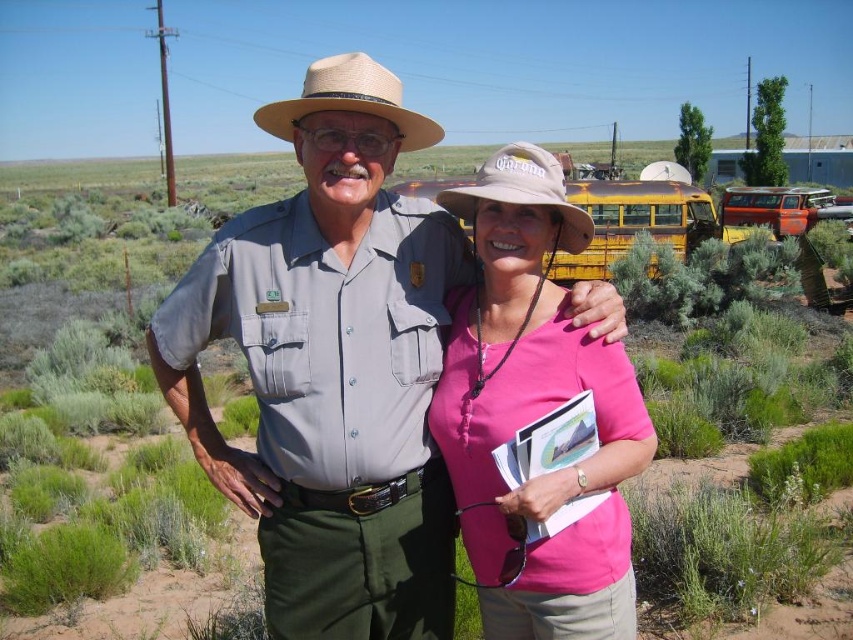
Based on the photo, you are a park visitor who wants to place a 3.5 feet wide picnic basket between the tan straw cowboy hat at center and the tan fabric cowboy hat at center. Can you fit it there?

The distance between the tan straw cowboy hat at center and the tan fabric cowboy hat at center is 4.76 feet. Since the picnic basket is 3.5 feet wide, it can fit within the space as 3.5 is less than 4.76.